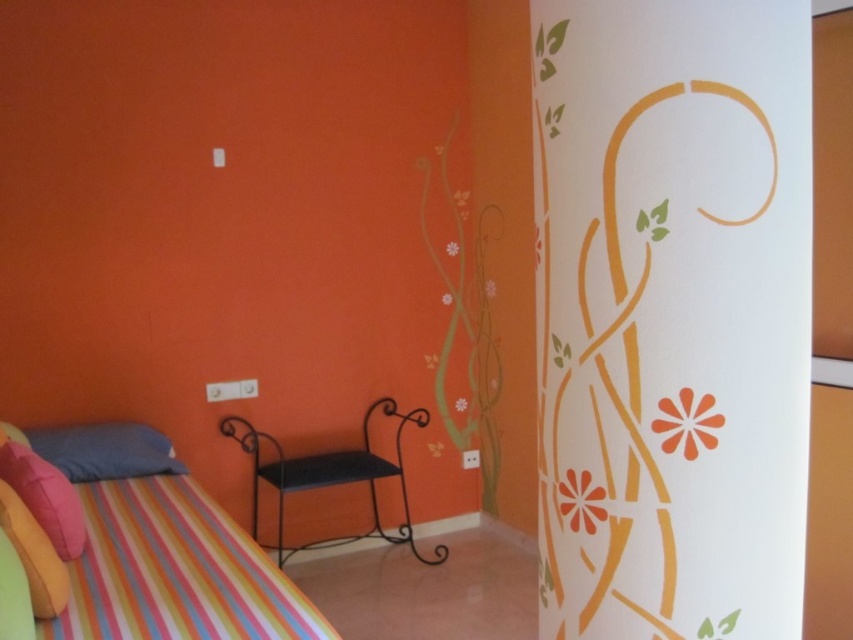
Question: Which point is closer to the camera?

Choices:
 (A) (194, 484)
 (B) (103, 468)

Answer: (B)

Question: Which of the following is the closest to the observer?

Choices:
 (A) (287, 486)
 (B) (271, 612)
 (C) (16, 480)

Answer: (B)

Question: Is striped fabric bed at lower left above matte blue pillow at lower left?

Choices:
 (A) yes
 (B) no

Answer: (B)

Question: Among these points, which one is nearest to the camera?

Choices:
 (A) (363, 474)
 (B) (9, 440)
 (C) (119, 593)
 (D) (10, 524)

Answer: (D)

Question: Is striped fabric bed at lower left to the right of velvet pink pillow at lower left from the viewer's perspective?

Choices:
 (A) yes
 (B) no

Answer: (A)

Question: From the image, what is the correct spatial relationship of matte blue pillow at lower left in relation to soft velvet pillow at lower left?

Choices:
 (A) left
 (B) right

Answer: (A)